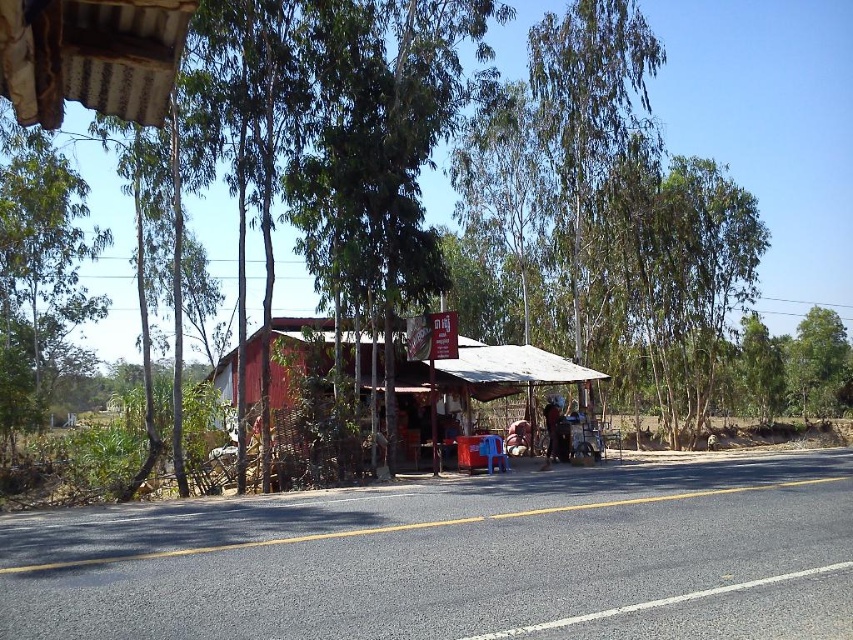
Is green leafy tree at left above red wooden hut at center?

Yes.

Can you confirm if green leafy tree at left is wider than red wooden hut at center?

Yes.

Which is behind, point (35, 195) or point (476, 374)?

The point (35, 195) is behind.

Where is `green leafy tree at left`? green leafy tree at left is located at coordinates (39, 272).

Is point (55, 324) farther from viewer compared to point (132, 36)?

Yes.

Does green leafy tree at left appear under white corrugated metal roof at upper left?

No.

Locate an element on the screen. This screenshot has height=640, width=853. green leafy tree at left is located at coordinates (39, 272).

You are a GUI agent. You are given a task and a screenshot of the screen. Output one action in this format:
    pyautogui.click(x=<x>, y=<y>)
    Task: Click on the green leafy tree at left
    Image resolution: width=853 pixels, height=640 pixels.
    Given the screenshot: What is the action you would take?
    pyautogui.click(x=39, y=272)

Does white corrugated metal roof at upper left appear under red wooden hut at center?

No.

Who is more distant from viewer, (100, 51) or (296, 332)?

Positioned behind is point (296, 332).

You are a GUI agent. You are given a task and a screenshot of the screen. Output one action in this format:
    pyautogui.click(x=<x>, y=<y>)
    Task: Click on the white corrugated metal roof at upper left
    The width and height of the screenshot is (853, 640).
    Given the screenshot: What is the action you would take?
    pyautogui.click(x=90, y=56)